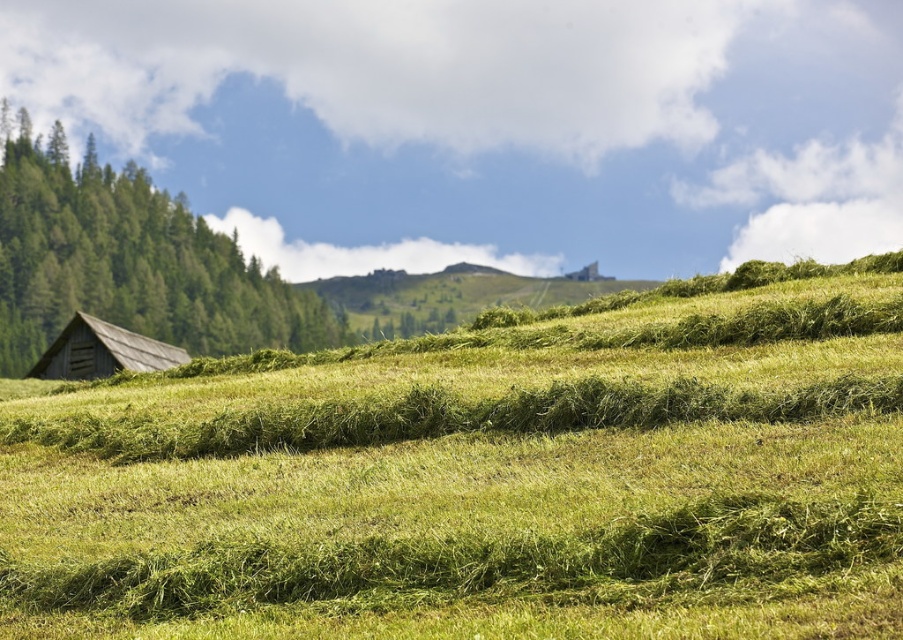
You are standing at the origin point of the image coordinate system, where the bottom left corner is considered as the origin. You want to walk to the green grassy field at center. In which direction should you move relative to your current position?

The green grassy field at center is located at coordinates point (481, 481). Since you are at the origin point (0, 0), you should move towards the northeast direction to reach it.

You are a farmer checking the field and see the green matte tree at left and the wooden barn at lower left. Which object is larger in size?

The green matte tree at left is bigger than the wooden barn at lower left.